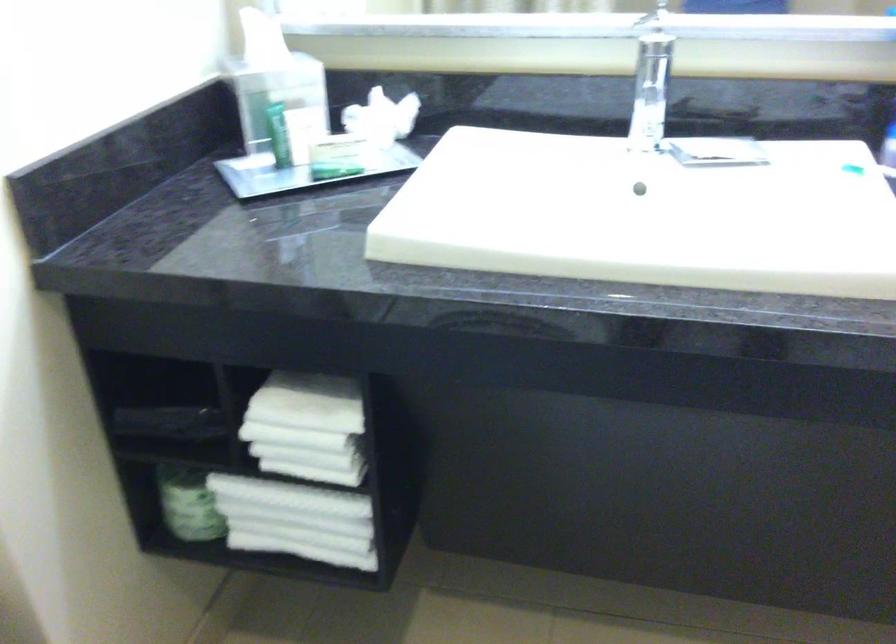
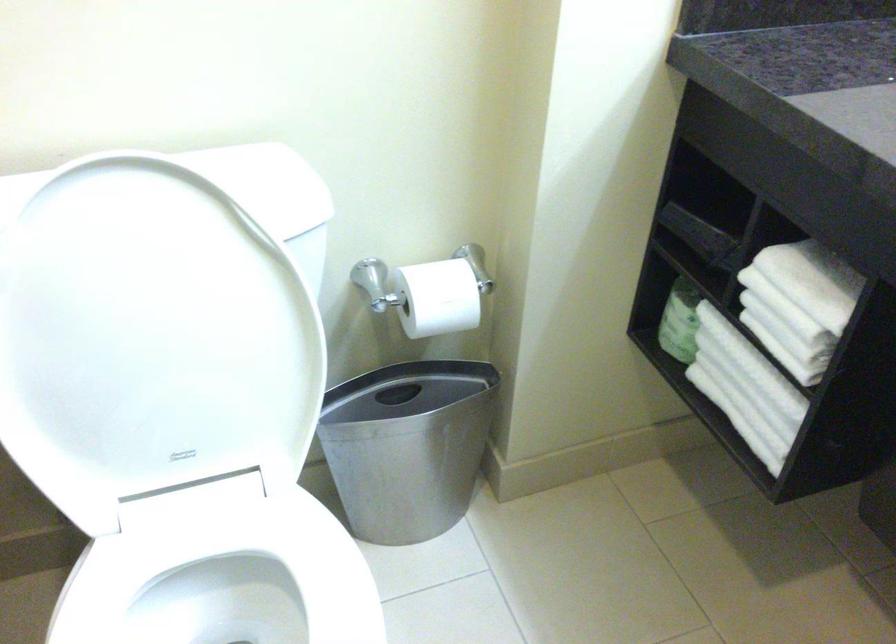
Locate, in the second image, the point that corresponds to (x=305, y=408) in the first image.

(806, 281)